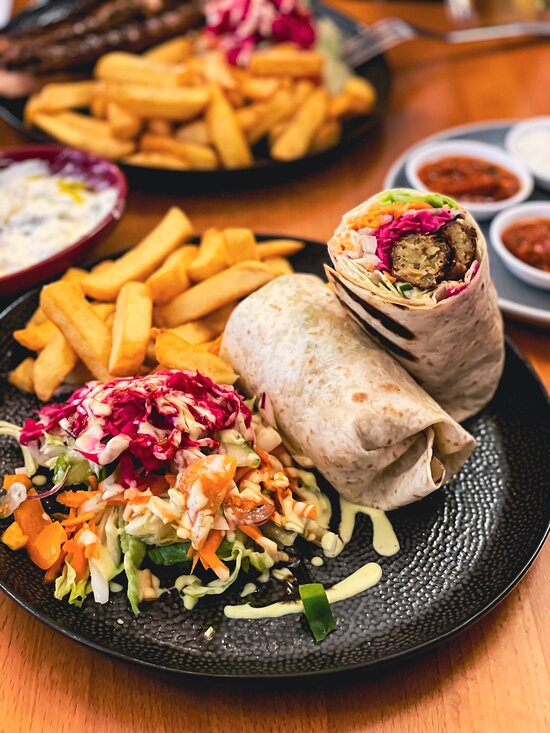
At what (x,y) coordinates should I click in order to perform the action: click on woodgrain surface. Please return your answer as a coordinate pair (x, y). The width and height of the screenshot is (550, 733). Looking at the image, I should click on (53, 688).